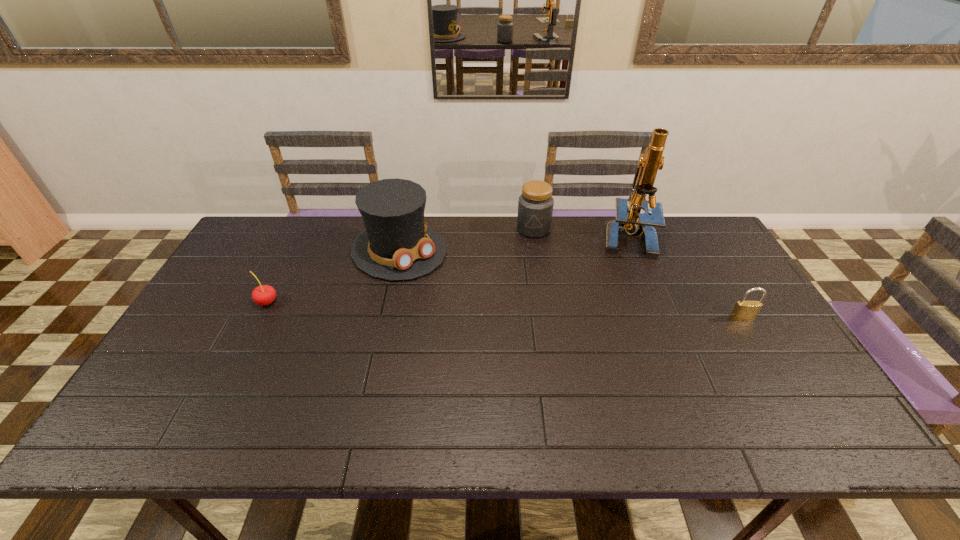
The width and height of the screenshot is (960, 540). Find the location of `blank region between the fourth object from left to right and the leftmost object`. blank region between the fourth object from left to right and the leftmost object is located at coordinates (447, 269).

Locate which object is the closest to the tallest object. Please provide its 2D coordinates. Your answer should be formatted as a tuple, i.e. [(x, y)], where the tuple contains the x and y coordinates of a point satisfying the conditions above.

[(535, 205)]

Choose which object is the fourth nearest neighbor to the leftmost object. Please provide its 2D coordinates. Your answer should be formatted as a tuple, i.e. [(x, y)], where the tuple contains the x and y coordinates of a point satisfying the conditions above.

[(743, 310)]

Find the location of `vacant region that satisfies the following two spatial constraints: 1. on the back side of the fourth object from left to right; 2. on the right side of the cherry`. vacant region that satisfies the following two spatial constraints: 1. on the back side of the fourth object from left to right; 2. on the right side of the cherry is located at coordinates (300, 237).